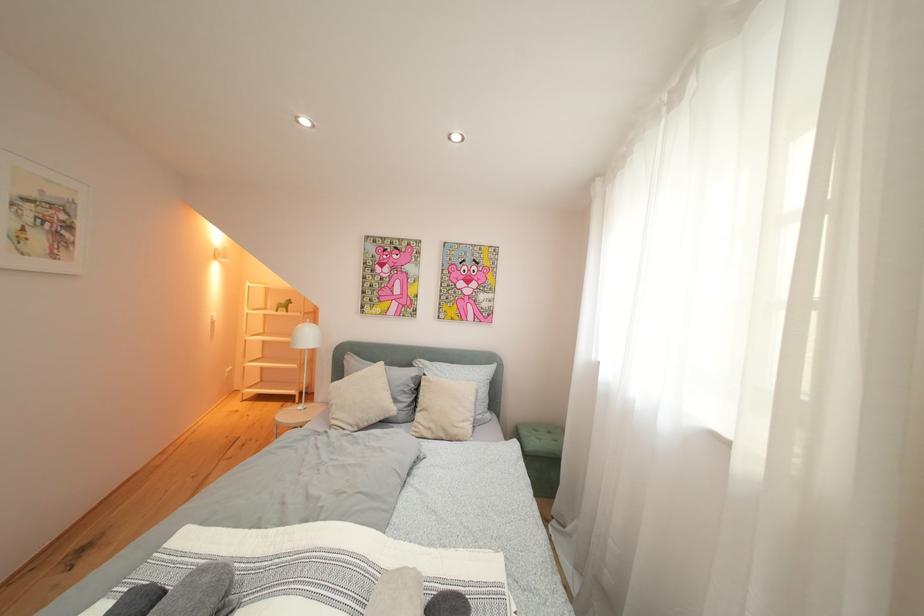
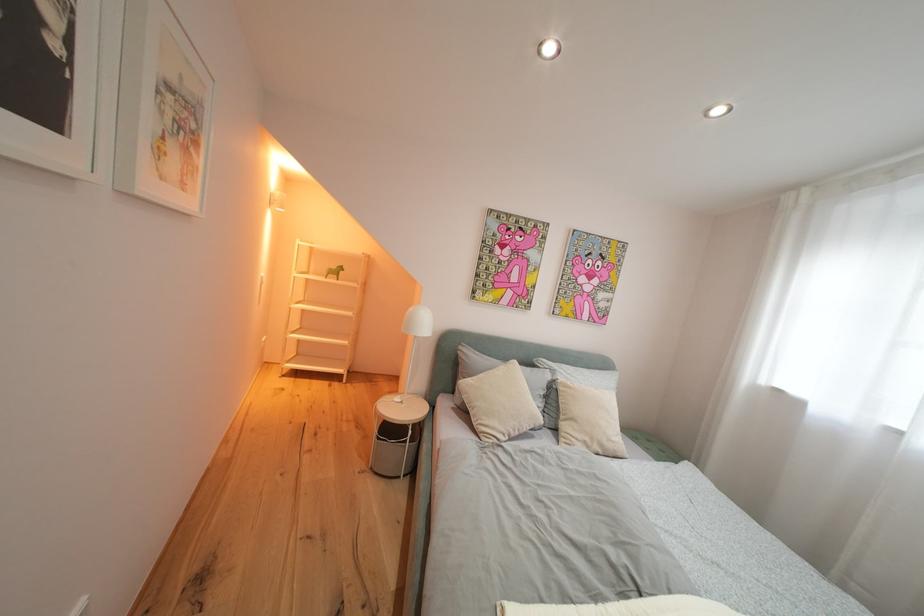
Question: In a continuous first-person perspective shot, in which direction is the camera moving?

Choices:
 (A) Left
 (B) Right
 (C) Forward
 (D) Backward

Answer: (A)